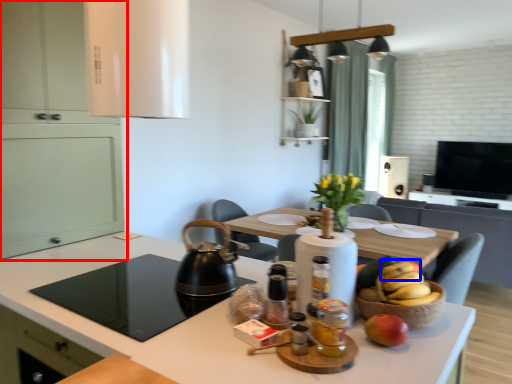
Question: Which object is further to the camera taking this photo, cabinetry (highlighted by a red box) or banana (highlighted by a blue box)?

Choices:
 (A) cabinetry
 (B) banana

Answer: (A)